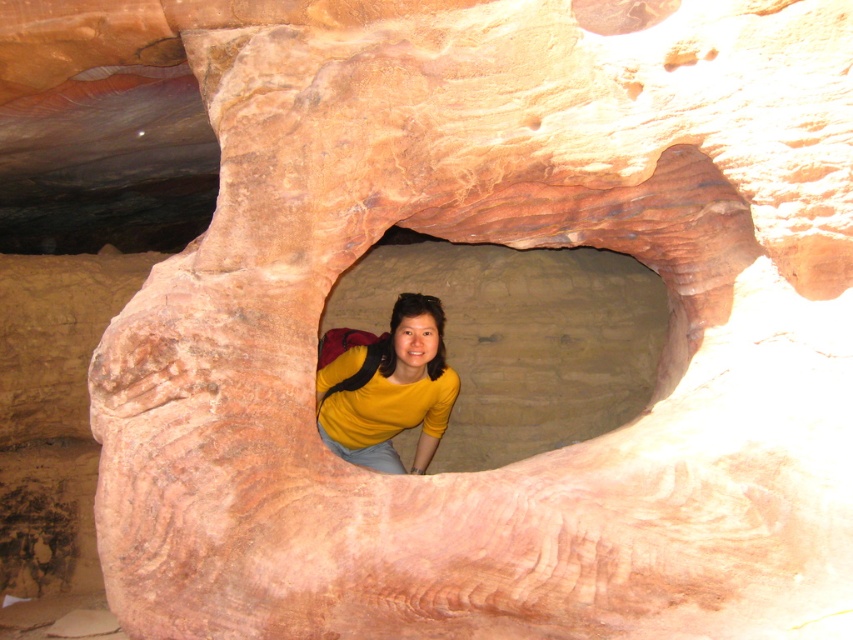
You are an explorer in a cave and see a person wearing a matte yellow shirt at center and a yellow matte shirt at center. Which shirt is on the right side?

The matte yellow shirt at center is on the right side of the yellow matte shirt at center.